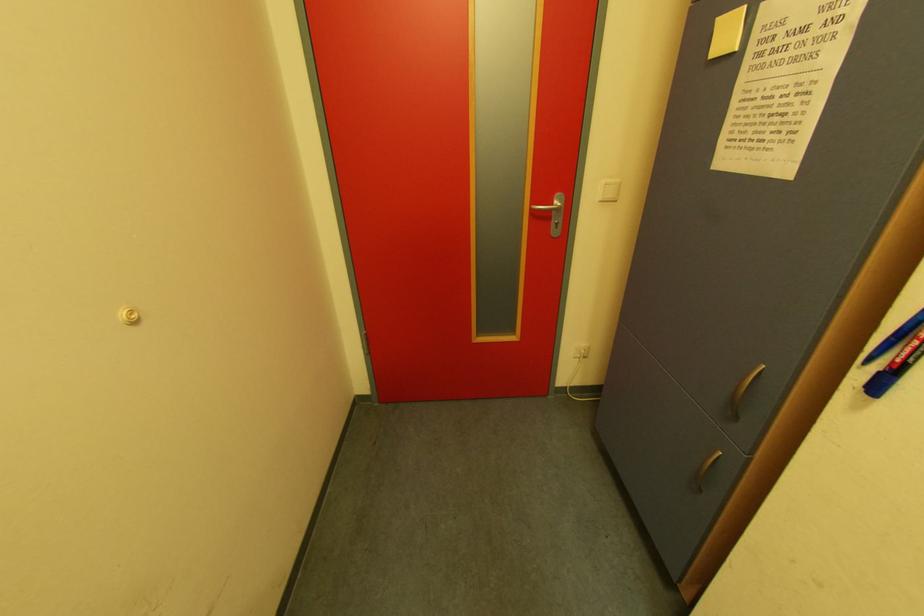
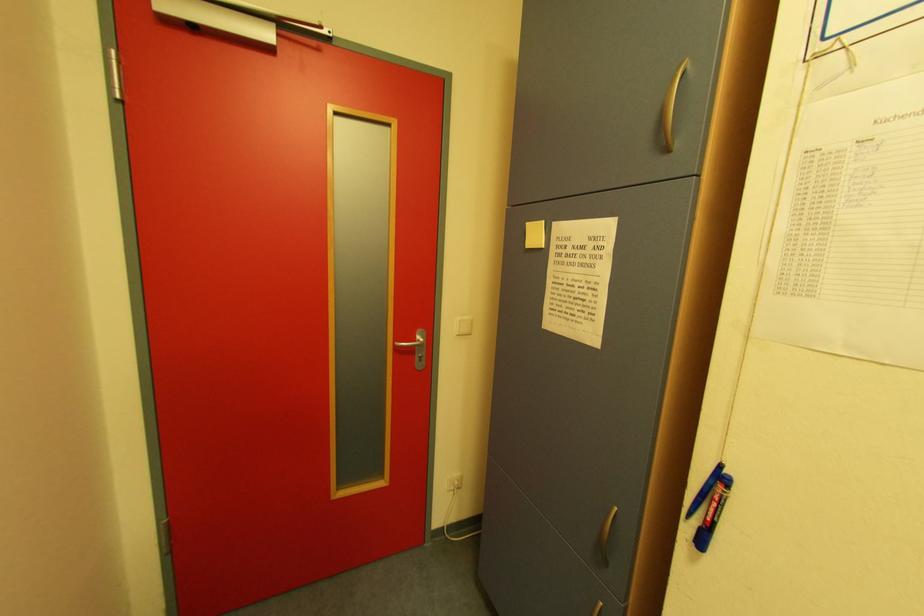
Question: What movement of the cameraman would produce the second image?

Choices:
 (A) Left
 (B) Right
 (C) Forward
 (D) Backward

Answer: (C)